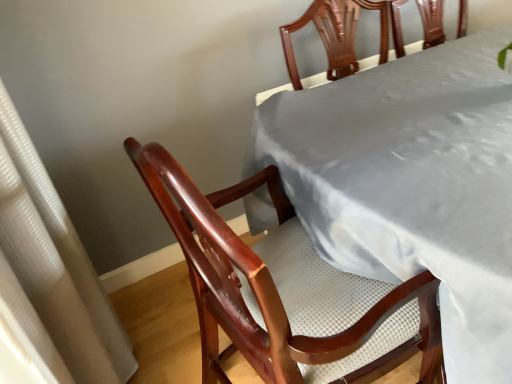
Question: From a real-world perspective, is white textured curtain at left positioned above or below satin gray tablecloth at upper center?

Choices:
 (A) below
 (B) above

Answer: (B)

Question: Is point (9, 236) closer or farther from the camera than point (428, 144)?

Choices:
 (A) farther
 (B) closer

Answer: (B)

Question: Is white textured curtain at left to the left or to the right of satin gray tablecloth at upper center in the image?

Choices:
 (A) left
 (B) right

Answer: (A)

Question: In terms of height, does satin gray tablecloth at upper center look taller or shorter compared to white textured curtain at left?

Choices:
 (A) tall
 (B) short

Answer: (B)

Question: Is satin gray tablecloth at upper center bigger or smaller than white textured curtain at left?

Choices:
 (A) big
 (B) small

Answer: (A)

Question: Is satin gray tablecloth at upper center spatially inside white textured curtain at left, or outside of it?

Choices:
 (A) inside
 (B) outside

Answer: (B)

Question: From a real-world perspective, is satin gray tablecloth at upper center above or below white textured curtain at left?

Choices:
 (A) below
 (B) above

Answer: (A)